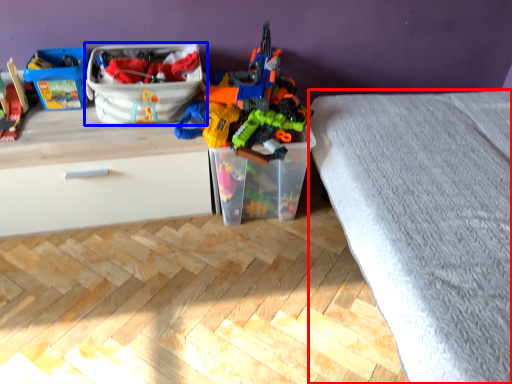
Question: Which object appears farthest to the camera in this image, bed frame (highlighted by a red box) or storage box (highlighted by a blue box)?

Choices:
 (A) bed frame
 (B) storage box

Answer: (B)